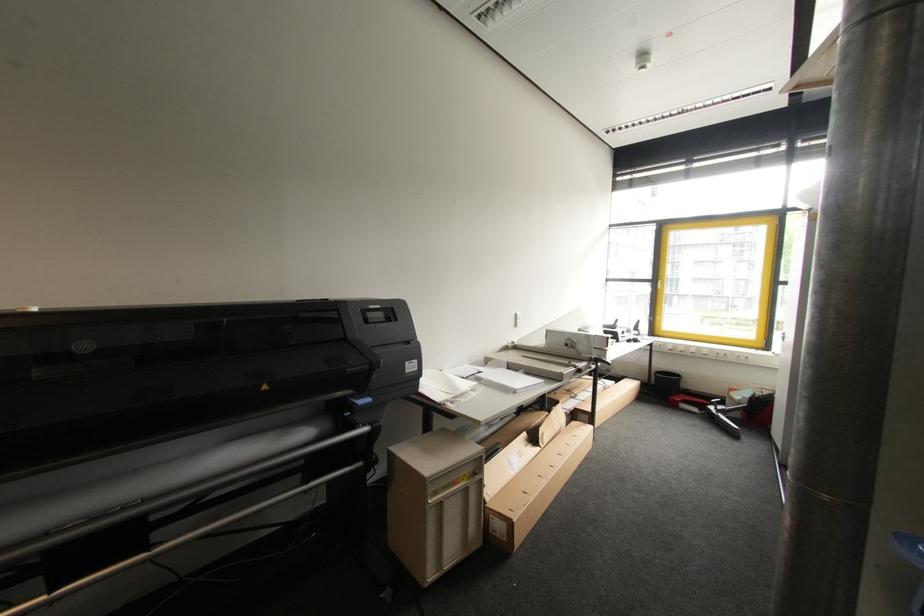
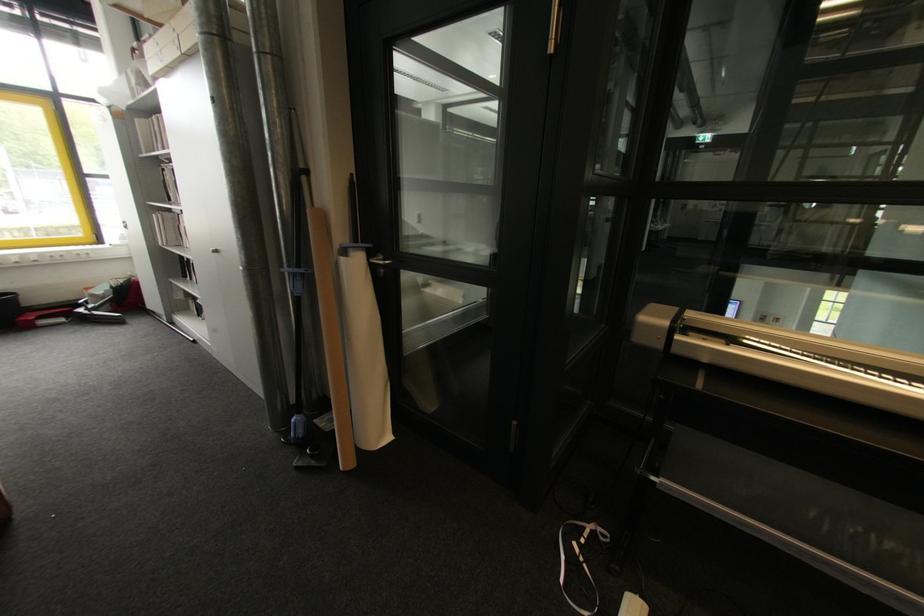
The point at (682, 382) is marked in the first image. Where is the corresponding point in the second image?

(19, 301)